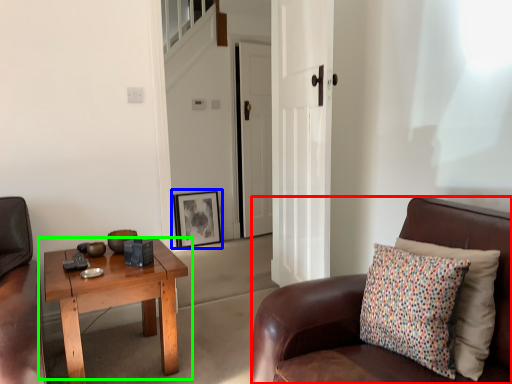
Question: Which object is positioned farthest from chair (highlighted by a red box)? Select from picture frame (highlighted by a blue box) and coffee table (highlighted by a green box).

Choices:
 (A) picture frame
 (B) coffee table

Answer: (A)